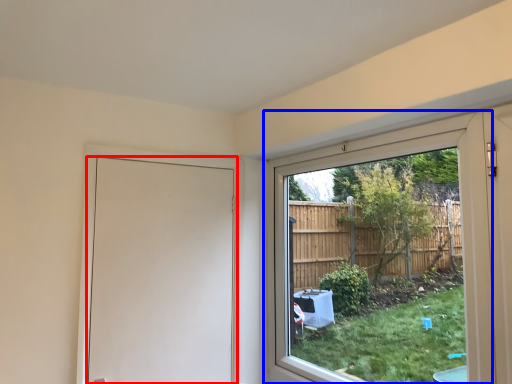
Question: Which of the following is the farthest to the observer, door (highlighted by a red box) or window (highlighted by a blue box)?

Choices:
 (A) door
 (B) window

Answer: (A)